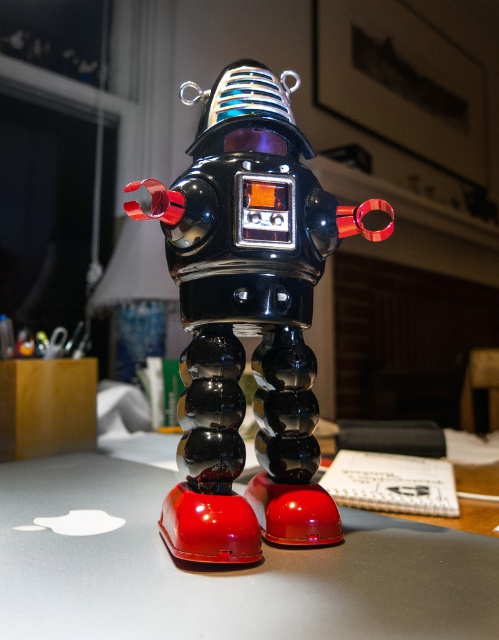
Is point (259, 362) farther from viewer compared to point (256, 605)?

Yes, it is behind point (256, 605).

Which is more to the left, glossy plastic robot at center or glossy metallic table at center?

From the viewer's perspective, glossy metallic table at center appears more on the left side.

Looking at this image, measure the distance between point (254, 65) and camera.

37.02 inches

Find the location of `glossy plastic robot at center`. glossy plastic robot at center is located at coordinates (248, 316).